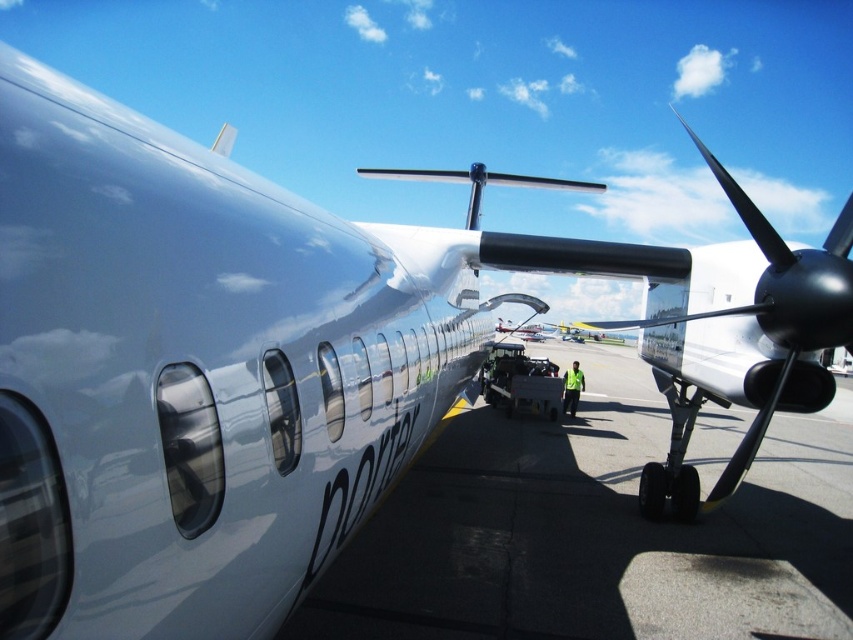
Question: Can you confirm if smooth concrete tarmac at center is bigger than shiny black propeller at right?

Choices:
 (A) no
 (B) yes

Answer: (A)

Question: Which object is farther from the camera taking this photo?

Choices:
 (A) smooth concrete tarmac at center
 (B) shiny black propeller at right

Answer: (B)

Question: Which point is farther to the camera?

Choices:
 (A) (782, 499)
 (B) (738, 269)

Answer: (A)

Question: Is smooth concrete tarmac at center bigger than shiny black propeller at right?

Choices:
 (A) yes
 (B) no

Answer: (B)

Question: Is the position of smooth concrete tarmac at center less distant than that of shiny black propeller at right?

Choices:
 (A) yes
 (B) no

Answer: (A)